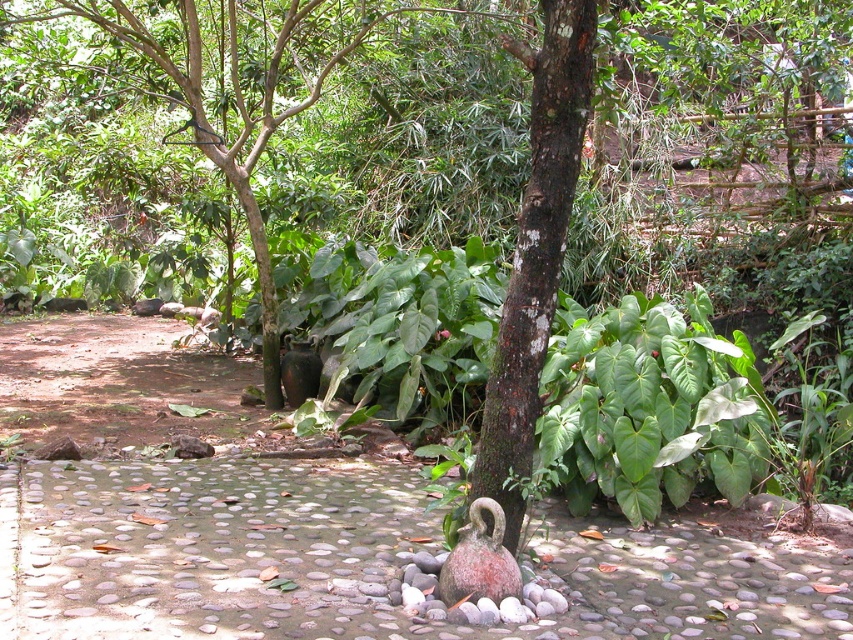
Does brown rough bark tree at center have a smaller size compared to rusty ceramic swan at center?

Actually, brown rough bark tree at center might be larger than rusty ceramic swan at center.

Who is taller, brown rough bark tree at center or rusty ceramic swan at center?

Standing taller between the two is brown rough bark tree at center.

Between point (532, 176) and point (498, 513), which one is positioned behind?

Point (532, 176)

Locate an element on the screen. The height and width of the screenshot is (640, 853). brown rough bark tree at center is located at coordinates (535, 252).

Is brown rough bark tree at center positioned in front of green leafy tree at center?

Yes, it is in front of green leafy tree at center.

Who is positioned more to the left, brown rough bark tree at center or green leafy tree at center?

green leafy tree at center is more to the left.

Does point (524, 406) come in front of point (199, 132)?

Yes, it is.

The image size is (853, 640). What are the coordinates of `brown rough bark tree at center` in the screenshot? It's located at (535, 252).

Is point (18, 563) positioned before point (339, 56)?

Yes, it is.

Which is above, pebble stone path at center or green leafy tree at center?

green leafy tree at center

The image size is (853, 640). In order to click on pebble stone path at center in this screenshot , I will do `click(355, 561)`.

Where is `pebble stone path at center`? pebble stone path at center is located at coordinates (355, 561).